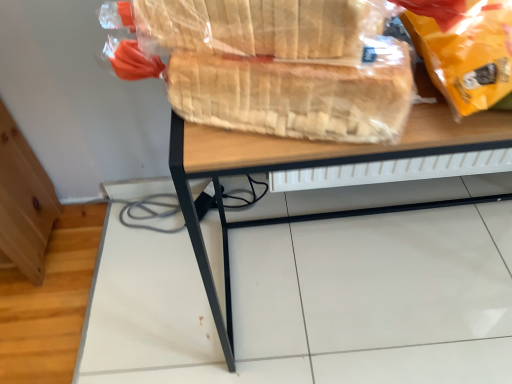
Question: In terms of width, does translucent plastic bread at upper center, acting as the first bread starting from the top, look wider or thinner when compared to wooden desk at center?

Choices:
 (A) thin
 (B) wide

Answer: (A)

Question: From a real-world perspective, is translucent plastic bread at upper center, the second bread ordered from the bottom, physically located above or below wooden desk at center?

Choices:
 (A) above
 (B) below

Answer: (A)

Question: Considering the real-world distances, which object is closest to the wooden desk at center?

Choices:
 (A) matte yellow plastic bag at upper right
 (B) translucent plastic bread at upper center, acting as the first bread starting from the top
 (C) translucent plastic bread at center, the 2th bread from the top

Answer: (C)

Question: Which of these objects is positioned farthest from the wooden desk at center?

Choices:
 (A) translucent plastic bread at upper center, acting as the first bread starting from the top
 (B) translucent plastic bread at center, the 2th bread from the top
 (C) matte yellow plastic bag at upper right

Answer: (C)